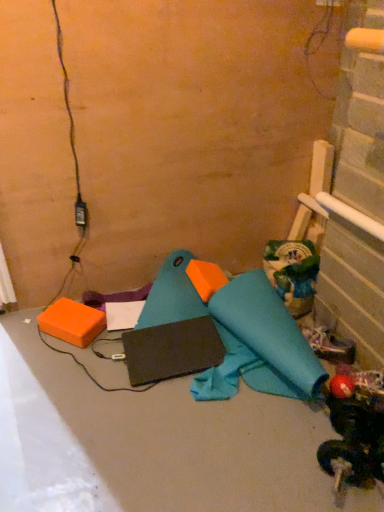
Find the location of a particular element. vacant region to the left of black matte laptop at center is located at coordinates (96, 380).